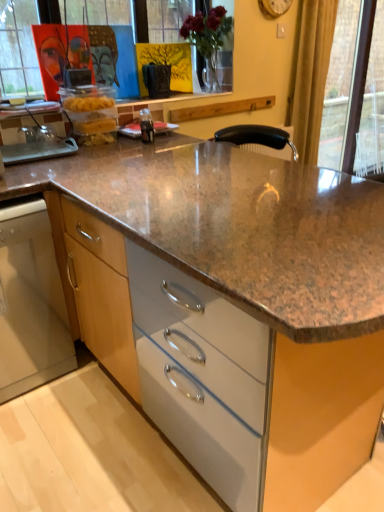
Question: Does transparent glass door at upper right touch gold textured curtain at right?

Choices:
 (A) no
 (B) yes

Answer: (A)

Question: Is transparent glass door at upper right shorter than gold textured curtain at right?

Choices:
 (A) no
 (B) yes

Answer: (A)

Question: Is transparent glass door at upper right at the left side of gold textured curtain at right?

Choices:
 (A) yes
 (B) no

Answer: (B)

Question: Is transparent glass door at upper right facing towards gold textured curtain at right?

Choices:
 (A) yes
 (B) no

Answer: (B)

Question: Can you confirm if transparent glass door at upper right is thinner than gold textured curtain at right?

Choices:
 (A) yes
 (B) no

Answer: (A)

Question: From a real-world perspective, is transparent glass door at upper right positioned under gold textured curtain at right based on gravity?

Choices:
 (A) yes
 (B) no

Answer: (A)

Question: From a real-world perspective, is satin stainless steel dishwasher at lower left on gold textured curtain at right?

Choices:
 (A) no
 (B) yes

Answer: (A)

Question: Is satin stainless steel dishwasher at lower left facing away from gold textured curtain at right?

Choices:
 (A) no
 (B) yes

Answer: (A)

Question: Can you confirm if satin stainless steel dishwasher at lower left is smaller than gold textured curtain at right?

Choices:
 (A) no
 (B) yes

Answer: (A)

Question: Is satin stainless steel dishwasher at lower left facing towards gold textured curtain at right?

Choices:
 (A) no
 (B) yes

Answer: (A)

Question: Considering the relative positions of satin stainless steel dishwasher at lower left and gold textured curtain at right in the image provided, is satin stainless steel dishwasher at lower left to the right of gold textured curtain at right from the viewer's perspective?

Choices:
 (A) yes
 (B) no

Answer: (B)

Question: From a real-world perspective, is satin stainless steel dishwasher at lower left under gold textured curtain at right?

Choices:
 (A) yes
 (B) no

Answer: (A)

Question: Is gold textured curtain at right bigger than transparent glass door at upper right?

Choices:
 (A) yes
 (B) no

Answer: (B)